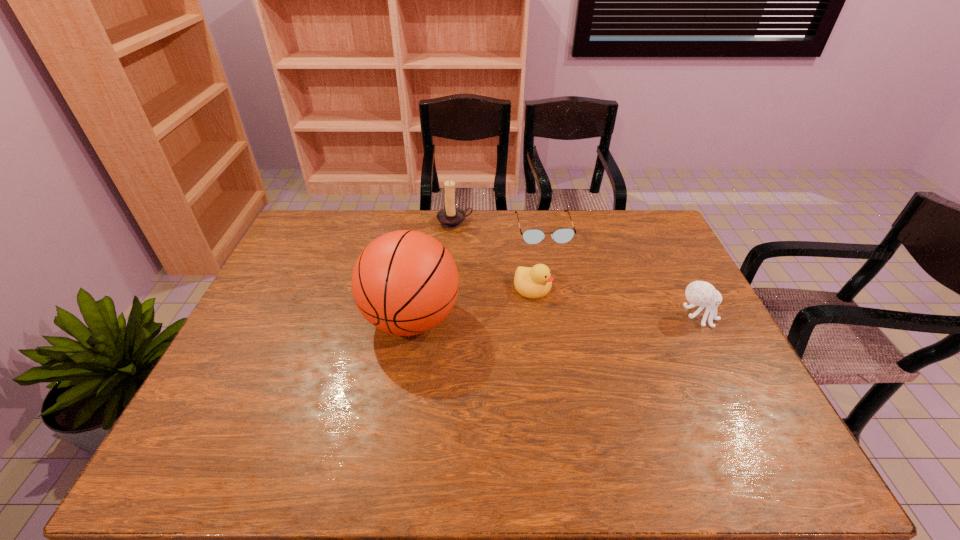
Where is `vacant space on the desktop that is between the tallest object and the third shortest object and is positioned on the face of the duckling`? This screenshot has height=540, width=960. vacant space on the desktop that is between the tallest object and the third shortest object and is positioned on the face of the duckling is located at coordinates (593, 318).

Identify the location of vacant space on the desktop that is between the basketball and the third tallest object and is positioned on the lenses of the shortest object. Image resolution: width=960 pixels, height=540 pixels. (567, 318).

Find the location of a particular element. The image size is (960, 540). free space on the desktop that is between the tallest object and the third tallest object and is positioned on the wick of the candle holder is located at coordinates (519, 319).